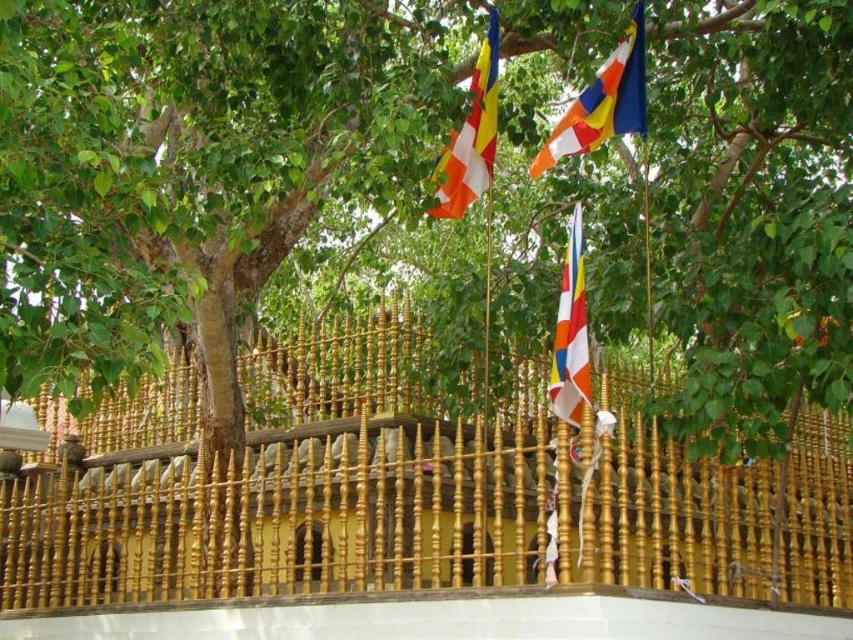
Which of these two, orange and white striped flag at upper center or striped fabric flag at center, stands shorter?

orange and white striped flag at upper center is shorter.

Is point (579, 138) farther from viewer compared to point (583, 358)?

Yes, point (579, 138) is farther from viewer.

Find the location of a particular element. Image resolution: width=853 pixels, height=640 pixels. orange and white striped flag at upper center is located at coordinates (602, 102).

Which is more to the right, gold polished fence at center or striped fabric flag at center?

striped fabric flag at center

Who is shorter, gold polished fence at center or striped fabric flag at center?

With less height is striped fabric flag at center.

Is point (306, 499) positioned after point (578, 408)?

That is True.

Where is `gold polished fence at center`? Image resolution: width=853 pixels, height=640 pixels. gold polished fence at center is located at coordinates (405, 493).

Does orange and white striped flag at upper center have a smaller size compared to multi-colored fabric flag at upper center?

No, orange and white striped flag at upper center is not smaller than multi-colored fabric flag at upper center.

Is point (618, 99) in front of point (445, 198)?

That is True.

The height and width of the screenshot is (640, 853). In order to click on orange and white striped flag at upper center in this screenshot , I will do `click(602, 102)`.